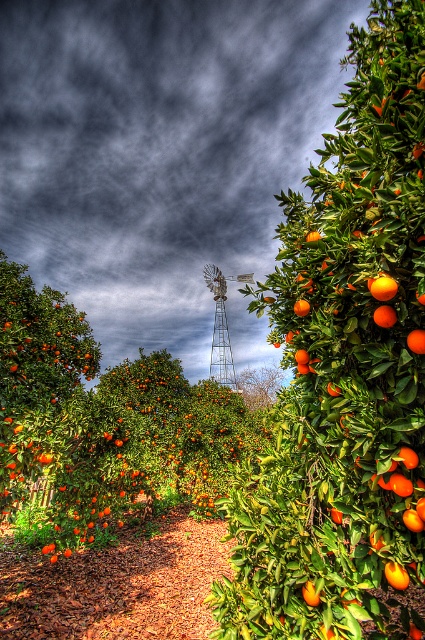
You are a gardener who needs to pick the glossy orange at right. From your current position at the start of the brown mulch path at center, can you see the orange directly without moving forward?

The glossy orange at right is behind the brown mulch path at center, so you cannot see it directly from your current position. You need to move forward past the brown mulch path at center to see it.

You are standing at the entrance of the orange grove and want to walk to the windmill in the background. According to the image, is the path at point (116, 584) covered with brown mulch?

Yes, the path at point (116, 584) is covered with brown mulch as stated in the scene description.

You are a farmer walking through the orange grove and need to reach the glossy orange at right. Which direction should you move from the brown mulch path at center?

The brown mulch path at center is to the left of the glossy orange at right, so you should move to the right from the brown mulch path at center to reach the glossy orange at right.